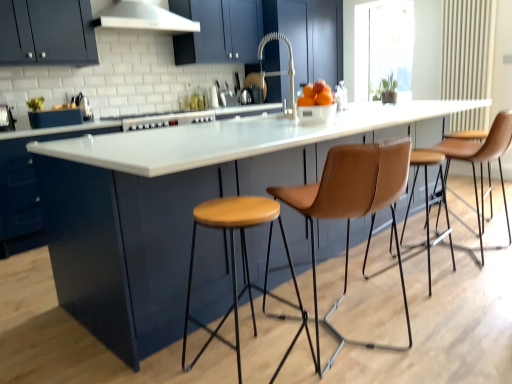
Find the location of a particular element. blank area beneath tan leather stool at center, the first chair viewed from the left (from a real-world perspective) is located at coordinates (348, 334).